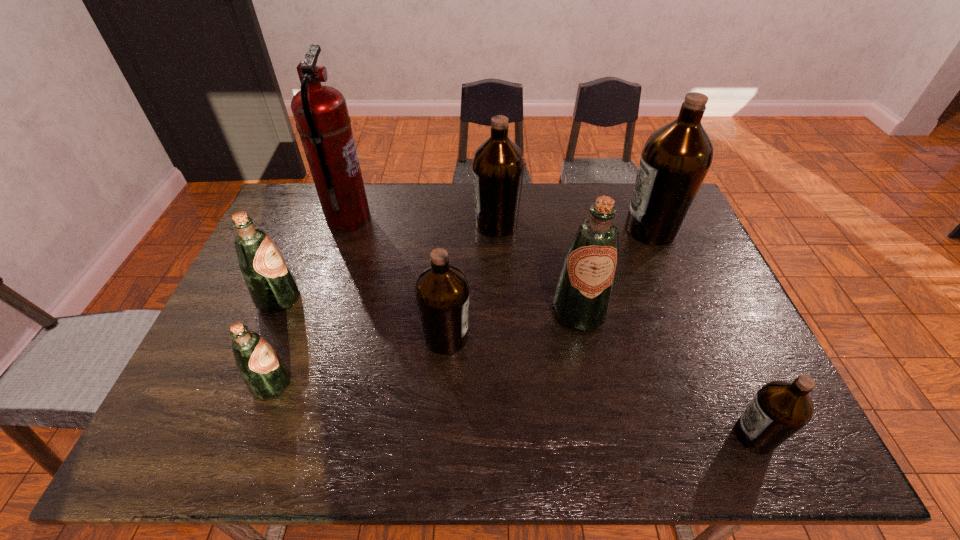
Identify the location of free area in between the second nearest object and the second nearest brown olive oil. The width and height of the screenshot is (960, 540). (359, 361).

Where is `free space between the second smallest brown olive oil and the second nearest olive oil`? The image size is (960, 540). free space between the second smallest brown olive oil and the second nearest olive oil is located at coordinates (359, 361).

Where is `unoccupied area between the seventh shortest object and the nearest object`? unoccupied area between the seventh shortest object and the nearest object is located at coordinates (703, 332).

Locate an element on the screen. The image size is (960, 540). object that is the seventh closest to the second biggest green olive oil is located at coordinates (780, 408).

Point out which object is positioned as the fifth nearest to the second biggest brown olive oil. Please provide its 2D coordinates. Your answer should be formatted as a tuple, i.e. [(x, y)], where the tuple contains the x and y coordinates of a point satisfying the conditions above.

[(273, 288)]

Locate which olive oil is the fourth closest to the third biggest brown olive oil. Please provide its 2D coordinates. Your answer should be formatted as a tuple, i.e. [(x, y)], where the tuple contains the x and y coordinates of a point satisfying the conditions above.

[(273, 288)]

This screenshot has width=960, height=540. Find the location of `olive oil that stands as the closest to the third smallest brown olive oil`. olive oil that stands as the closest to the third smallest brown olive oil is located at coordinates (582, 297).

Locate which brown olive oil is the closest to the fire extinguisher. Please provide its 2D coordinates. Your answer should be formatted as a tuple, i.e. [(x, y)], where the tuple contains the x and y coordinates of a point satisfying the conditions above.

[(498, 165)]

Choose which brown olive oil is the third nearest neighbor to the nearest object. Please provide its 2D coordinates. Your answer should be formatted as a tuple, i.e. [(x, y)], where the tuple contains the x and y coordinates of a point satisfying the conditions above.

[(498, 165)]

Locate an element on the screen. The height and width of the screenshot is (540, 960). green olive oil that is the closest to the second smallest green olive oil is located at coordinates (265, 374).